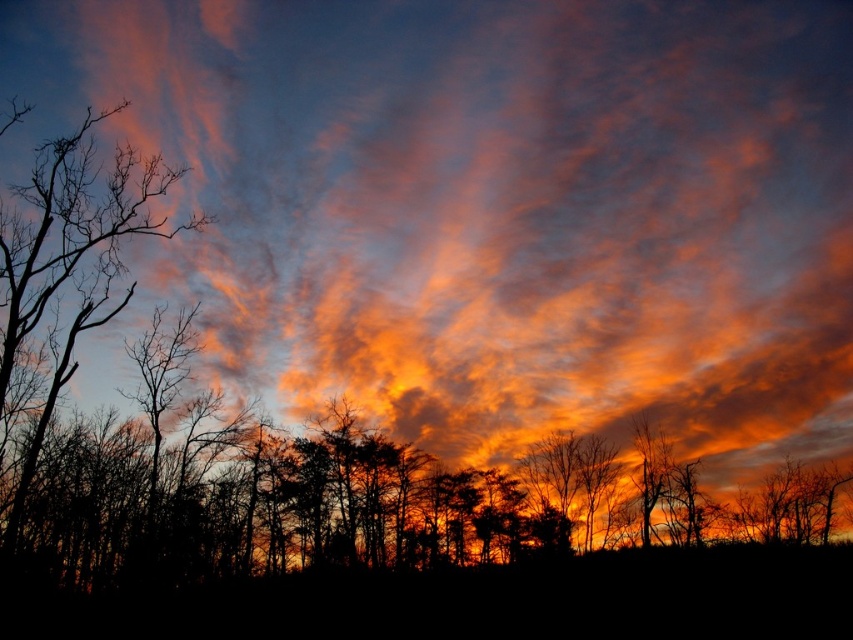
Does silhouette tree at center have a greater width compared to silhouette bare tree at left?

Indeed, silhouette tree at center has a greater width compared to silhouette bare tree at left.

Where is `silhouette tree at center`? silhouette tree at center is located at coordinates (334, 493).